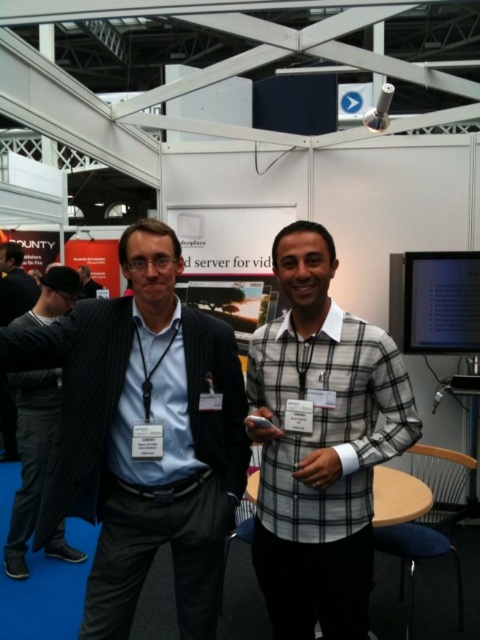
Who is positioned more to the right, dark blue pinstripe suit at center or plaid cotton shirt at center?

plaid cotton shirt at center is more to the right.

Between dark blue pinstripe suit at center and plaid cotton shirt at center, which one has more height?

With more height is dark blue pinstripe suit at center.

Is point (104, 492) positioned before point (320, 547)?

That is False.

Identify the location of dark blue pinstripe suit at center. (144, 435).

You are a GUI agent. You are given a task and a screenshot of the screen. Output one action in this format:
    pyautogui.click(x=<x>, y=<y>)
    Task: Click on the dark gray suit at center
    
    Given the screenshot: What is the action you would take?
    pyautogui.click(x=14, y=284)

Is dark gray suit at center positioned before matte black suit at center?

Yes, it is.

Identify the location of dark gray suit at center. The image size is (480, 640). point(14,284).

Based on the photo, does dark blue pinstripe suit at center have a greater height compared to matte black suit at center?

Yes, dark blue pinstripe suit at center is taller than matte black suit at center.

Is dark blue pinstripe suit at center thinner than matte black suit at center?

Incorrect, dark blue pinstripe suit at center's width is not less than matte black suit at center's.

Between point (73, 432) and point (88, 294), which one is positioned in front?

Point (73, 432)

Identify the location of dark blue pinstripe suit at center. (144, 435).